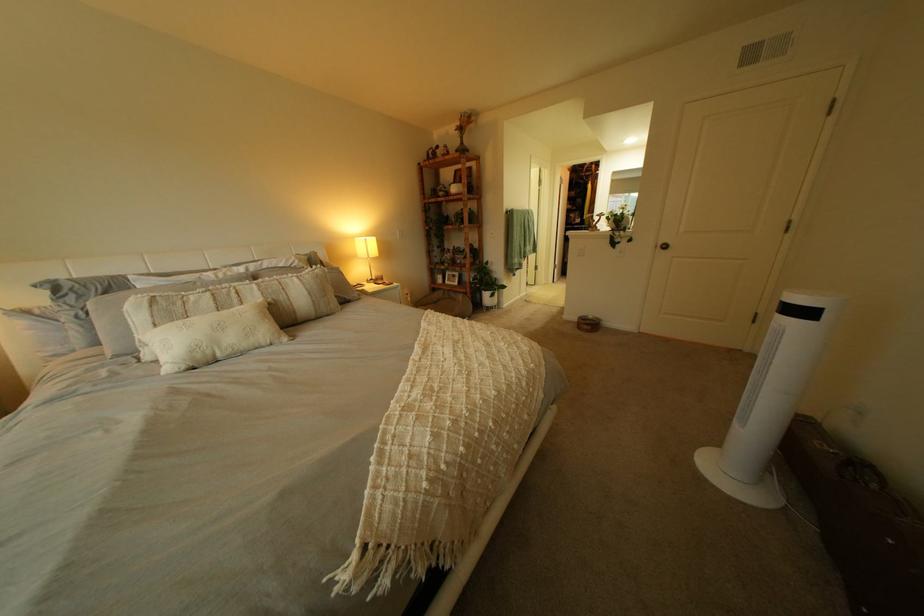
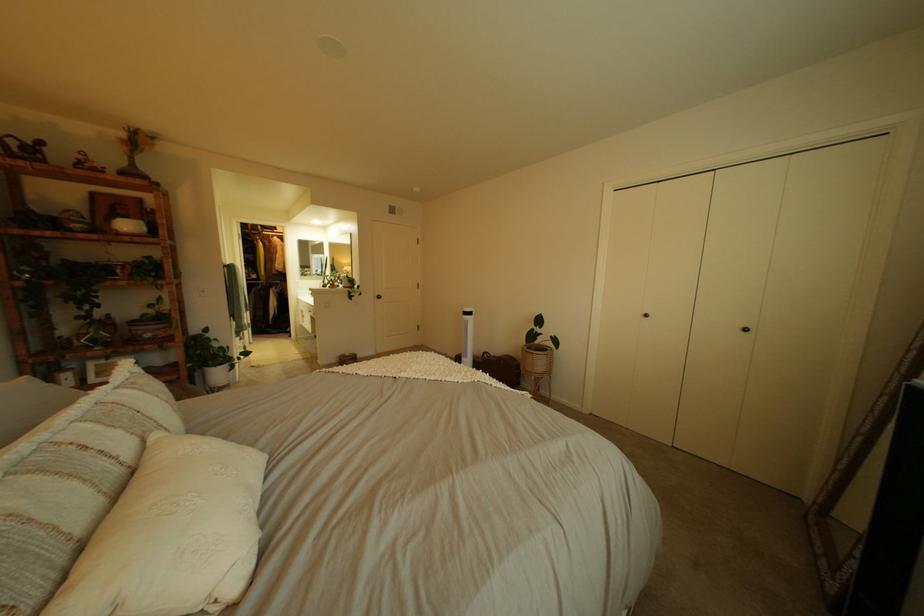
Find the pixel in the second image that matches pixel 610 168 in the first image.

(274, 228)